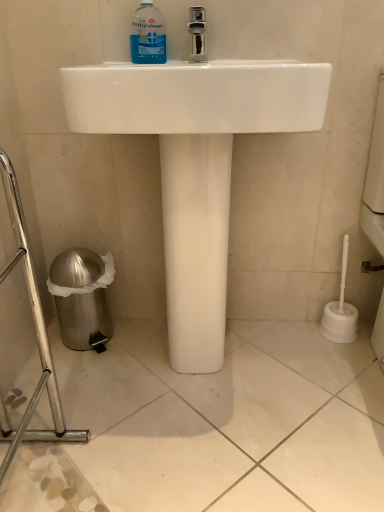
Describe the element at coordinates (148, 35) in the screenshot. This screenshot has height=512, width=384. I see `blue transparent liquid at upper center` at that location.

At what (x,y) coordinates should I click in order to perform the action: click on blue transparent liquid at upper center. Please return your answer as a coordinate pair (x, y). Looking at the image, I should click on (148, 35).

The width and height of the screenshot is (384, 512). What do you see at coordinates (196, 164) in the screenshot?
I see `white glossy sink at center` at bounding box center [196, 164].

At what (x,y) coordinates should I click in order to perform the action: click on white glossy sink at center. Please return your answer as a coordinate pair (x, y). Looking at the image, I should click on (196, 164).

Locate an element on the screen. Image resolution: width=384 pixels, height=512 pixels. blue transparent liquid at upper center is located at coordinates (148, 35).

Considering the relative positions of white glossy sink at center and blue transparent liquid at upper center in the image provided, is white glossy sink at center to the left of blue transparent liquid at upper center from the viewer's perspective?

Incorrect, white glossy sink at center is not on the left side of blue transparent liquid at upper center.

Between white glossy sink at center and blue transparent liquid at upper center, which one is positioned in front?

white glossy sink at center is more forward.

Considering the points (225, 313) and (147, 52), which point is behind, point (225, 313) or point (147, 52)?

The point (225, 313) is farther from the camera.

Based on the photo, from the image's perspective, is white glossy sink at center under blue transparent liquid at upper center?

Indeed, from the image's perspective, white glossy sink at center is shown beneath blue transparent liquid at upper center.

From a real-world perspective, is white glossy sink at center positioned above or below blue transparent liquid at upper center?

In terms of real-world spatial position, white glossy sink at center is below blue transparent liquid at upper center.

Which object is wider, white glossy sink at center or blue transparent liquid at upper center?

Wider between the two is white glossy sink at center.

Considering the relative sizes of white glossy sink at center and blue transparent liquid at upper center in the image provided, is white glossy sink at center shorter than blue transparent liquid at upper center?

No, white glossy sink at center is not shorter than blue transparent liquid at upper center.

Which of these two, white glossy sink at center or blue transparent liquid at upper center, is bigger?

white glossy sink at center is bigger.

Consider the image. Is blue transparent liquid at upper center completely or partially inside white glossy sink at center?

Yes.

Would you say white glossy sink at center is a long distance from blue transparent liquid at upper center?

Actually, white glossy sink at center and blue transparent liquid at upper center are a little close together.

Is blue transparent liquid at upper center at the back of white glossy sink at center?

Yes.

Can you tell me how much white glossy sink at center and blue transparent liquid at upper center differ in facing direction?

There is a 1.21-degree angle between the facing directions of white glossy sink at center and blue transparent liquid at upper center.

Identify the location of cleaning product that appears behind the white glossy sink at center. Image resolution: width=384 pixels, height=512 pixels. (148, 35).

Between blue transparent liquid at upper center and white glossy sink at center, which one appears on the left side from the viewer's perspective?

blue transparent liquid at upper center is more to the left.

Which object is closer to the camera, blue transparent liquid at upper center or white glossy sink at center?

white glossy sink at center is more forward.

Is point (142, 46) positioned after point (234, 110)?

Yes, it is behind point (234, 110).

From the image's perspective, which object appears higher, blue transparent liquid at upper center or white glossy sink at center?

blue transparent liquid at upper center.

From a real-world perspective, does blue transparent liquid at upper center stand above white glossy sink at center?

Yes, from a real-world perspective, blue transparent liquid at upper center is above white glossy sink at center.

Considering the sizes of objects blue transparent liquid at upper center and white glossy sink at center in the image provided, who is thinner, blue transparent liquid at upper center or white glossy sink at center?

Thinner between the two is blue transparent liquid at upper center.

Considering the relative sizes of blue transparent liquid at upper center and white glossy sink at center in the image provided, is blue transparent liquid at upper center taller than white glossy sink at center?

No, blue transparent liquid at upper center is not taller than white glossy sink at center.

Looking at this image, considering the relative sizes of blue transparent liquid at upper center and white glossy sink at center in the image provided, is blue transparent liquid at upper center smaller than white glossy sink at center?

Yes.

Looking at this image, choose the correct answer: Is blue transparent liquid at upper center inside white glossy sink at center or outside it?

blue transparent liquid at upper center can be found inside white glossy sink at center.

Is blue transparent liquid at upper center touching white glossy sink at center?

blue transparent liquid at upper center and white glossy sink at center are not in contact.

Is blue transparent liquid at upper center turned away from white glossy sink at center?

Yes, blue transparent liquid at upper center is facing away from white glossy sink at center.

Locate an element on the screen. sink that appears below the blue transparent liquid at upper center (from the image's perspective) is located at coordinates (196, 164).

The width and height of the screenshot is (384, 512). Find the location of `sink below the blue transparent liquid at upper center (from a real-world perspective)`. sink below the blue transparent liquid at upper center (from a real-world perspective) is located at coordinates (196, 164).

The height and width of the screenshot is (512, 384). What are the coordinates of `sink lying in front of the blue transparent liquid at upper center` in the screenshot? It's located at (196, 164).